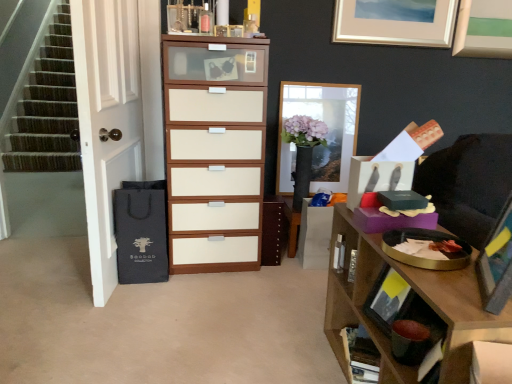
Question: Considering the relative sizes of wooden bookshelf at lower right and wooden tray at upper right in the image provided, is wooden bookshelf at lower right bigger than wooden tray at upper right?

Choices:
 (A) yes
 (B) no

Answer: (B)

Question: Is wooden bookshelf at lower right positioned with its back to wooden tray at upper right?

Choices:
 (A) no
 (B) yes

Answer: (B)

Question: Is wooden bookshelf at lower right next to wooden tray at upper right?

Choices:
 (A) no
 (B) yes

Answer: (A)

Question: Can you confirm if wooden bookshelf at lower right is smaller than wooden tray at upper right?

Choices:
 (A) no
 (B) yes

Answer: (B)

Question: From a real-world perspective, is wooden bookshelf at lower right physically below wooden tray at upper right?

Choices:
 (A) no
 (B) yes

Answer: (B)

Question: Would you say wooden bookshelf at lower right is outside wooden tray at upper right?

Choices:
 (A) yes
 (B) no

Answer: (B)

Question: Can you confirm if wooden tray at upper right is positioned to the right of white glossy door at left?

Choices:
 (A) yes
 (B) no

Answer: (A)

Question: From a real-world perspective, is wooden tray at upper right on top of white glossy door at left?

Choices:
 (A) no
 (B) yes

Answer: (A)

Question: Does wooden tray at upper right have a lesser height compared to white glossy door at left?

Choices:
 (A) yes
 (B) no

Answer: (A)

Question: Is wooden tray at upper right to the left of white glossy door at left from the viewer's perspective?

Choices:
 (A) yes
 (B) no

Answer: (B)

Question: From a real-world perspective, is wooden tray at upper right under white glossy door at left?

Choices:
 (A) no
 (B) yes

Answer: (B)

Question: Are wooden tray at upper right and white glossy door at left located far from each other?

Choices:
 (A) yes
 (B) no

Answer: (A)

Question: Is white glossy door at left at the right side of wooden bookshelf at lower right?

Choices:
 (A) no
 (B) yes

Answer: (A)